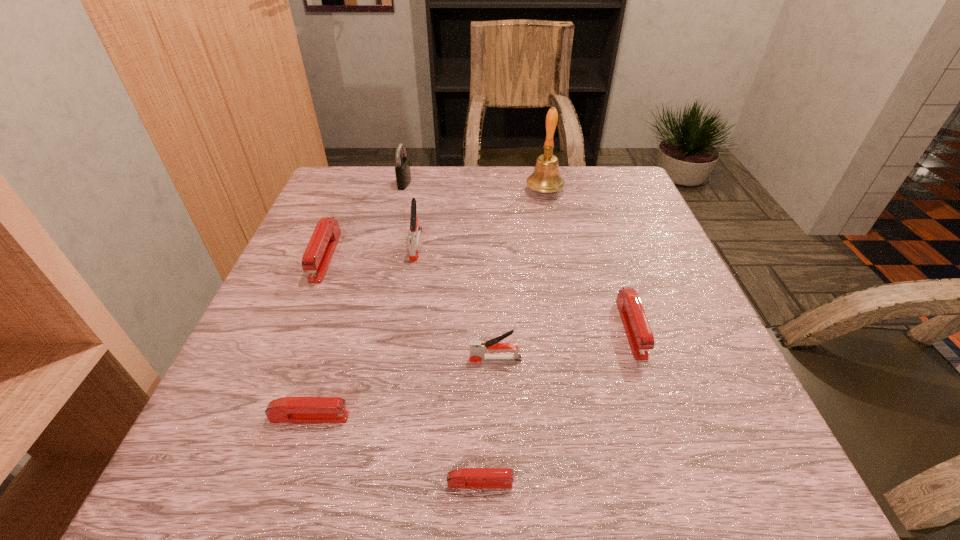
At what (x,y) coordinates should I click in order to perform the action: click on the rightmost object. Please return your answer as a coordinate pair (x, y). The image size is (960, 540). Looking at the image, I should click on [x=638, y=331].

Where is `the seventh tallest object`? This screenshot has height=540, width=960. the seventh tallest object is located at coordinates (286, 409).

The image size is (960, 540). In order to click on the second smallest red stapler in this screenshot , I will do `click(286, 409)`.

Locate an element on the screen. This screenshot has height=540, width=960. the nearest red stapler is located at coordinates (465, 478).

What are the coordinates of `the smallest red stapler` in the screenshot? It's located at (465, 478).

You are a GUI agent. You are given a task and a screenshot of the screen. Output one action in this format:
    pyautogui.click(x=<x>, y=<y>)
    Task: Click on the vacant space located on the right of the bell
    Image resolution: width=960 pixels, height=540 pixels.
    Given the screenshot: What is the action you would take?
    pyautogui.click(x=615, y=191)

Identify the location of vacant space located 0.130m on the left of the padlock. This screenshot has height=540, width=960. (351, 183).

Find the location of a particular element. vacant area located on the handle side of the left gray stapler is located at coordinates (410, 280).

The width and height of the screenshot is (960, 540). Identify the location of vacant space situated 0.130m on the handle side of the right gray stapler. (396, 359).

Where is `blank space located on the handle side of the right gray stapler`? blank space located on the handle side of the right gray stapler is located at coordinates (367, 359).